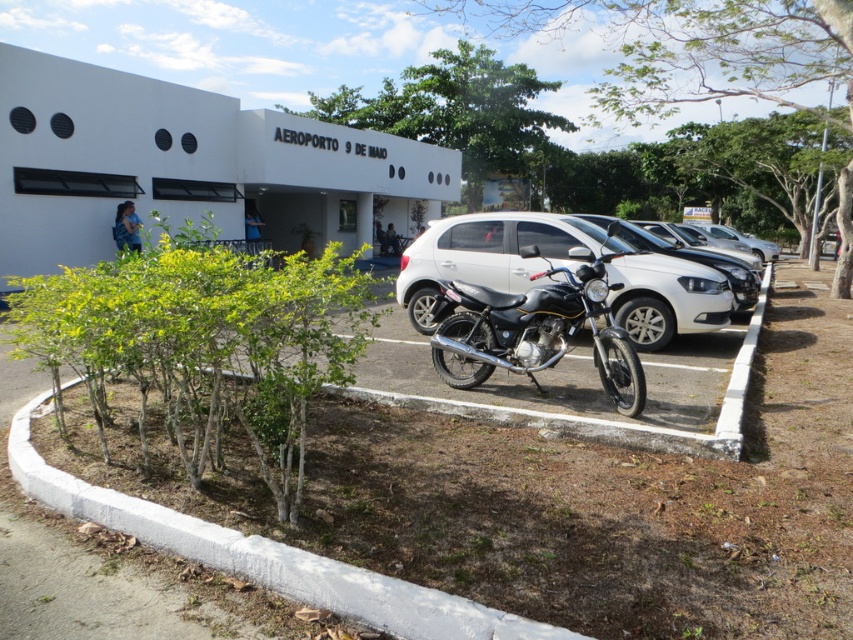
Between satin white car at center and black matte motorcycle at center, which one appears on the right side from the viewer's perspective?

satin white car at center

Between point (642, 300) and point (543, 288), which one is positioned in front?

Point (543, 288) is in front.

Does point (647, 291) come in front of point (476, 385)?

That is False.

At what (x,y) coordinates should I click in order to perform the action: click on satin white car at center. Please return your answer as a coordinate pair (x, y). Looking at the image, I should click on (560, 275).

Which of these two, satin white car at center or glossy white sedan at center, stands taller?

glossy white sedan at center is taller.

I want to click on satin white car at center, so [560, 275].

Based on the photo, does black matte motorcycle at center appear on the left side of glossy white sedan at center?

Correct, you'll find black matte motorcycle at center to the left of glossy white sedan at center.

Between black matte motorcycle at center and glossy white sedan at center, which one has less height?

Standing shorter between the two is black matte motorcycle at center.

Who is more forward, (445, 285) or (737, 304)?

Point (445, 285)

In order to click on black matte motorcycle at center in this screenshot , I will do `click(538, 332)`.